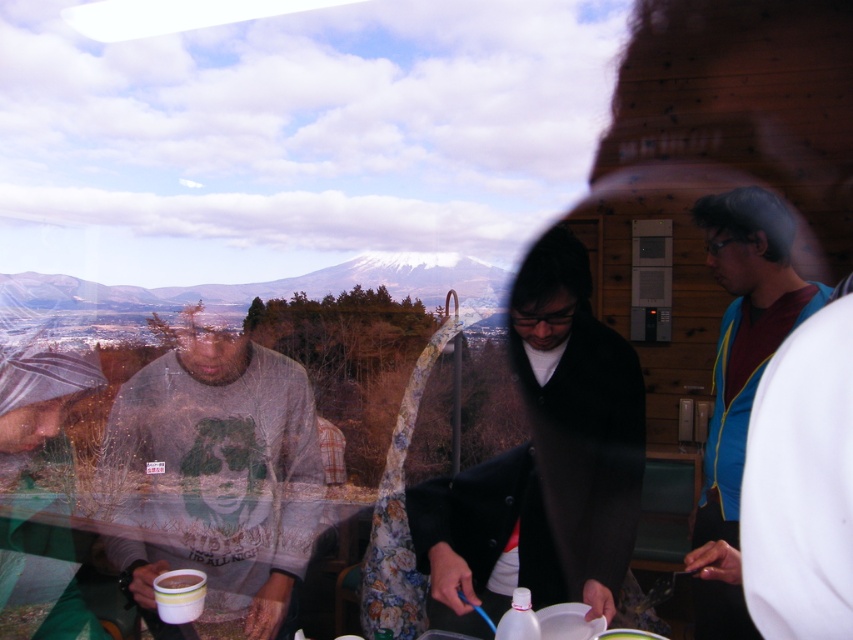
You are standing in front of the window and see the point at coordinate (45,557). What object is located at that point?

The point at coordinate (45,557) corresponds to the white glossy cup at lower left.

Consider the image. You are at a winter gathering and see two cups at the lower left of the scene. Which cup can hold more liquid, the white glossy cup at lower left or the white paper cup at lower left?

The white glossy cup at lower left can hold more liquid because it has a larger size compared to the white paper cup at lower left.

You are a guest at this gathering and want to grab the cup that is closer to the snowy mountain peak in the background. Which cup should you choose between the white glossy cup at lower left and the white matte cup at lower left?

The white glossy cup at lower left is to the left of the white matte cup at lower left. Since the snowy mountain peak is in the background, the cups are closer to the viewer than the mountain. Therefore, the position of the cups relative to each other doesn not determine their distance to the mountain. You need to look for other clues in the scene description to determine which cup is closer to the mountain. However, the provided information does not specify their distance from the mountain, so it cannot be